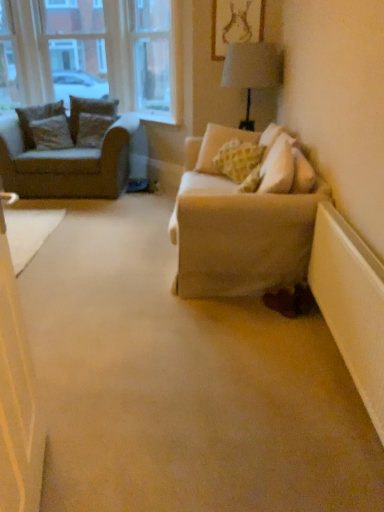
Identify the location of vacant space underneath white plastic radiator at lower right (from a real-world perspective). This screenshot has height=512, width=384. (355, 395).